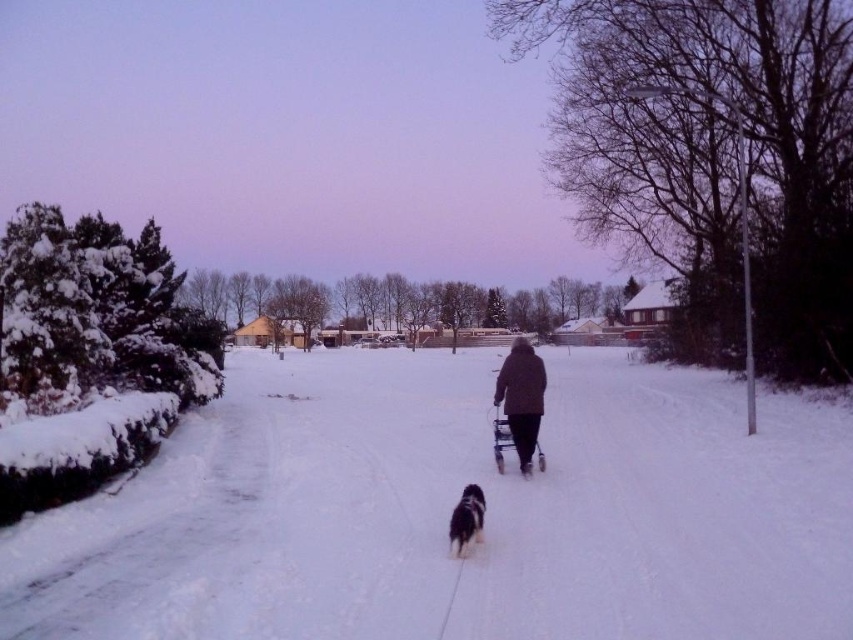
Between fluffy black dog at center and black plastic walker at center, which one is positioned lower?

fluffy black dog at center is below.

Can you confirm if fluffy black dog at center is bigger than black plastic walker at center?

Correct, fluffy black dog at center is larger in size than black plastic walker at center.

Who is more forward, (462, 502) or (537, 451)?

Point (462, 502) is more forward.

What are the coordinates of `fluffy black dog at center` in the screenshot? It's located at (466, 518).

Which is in front, point (357, 614) or point (538, 444)?

Positioned in front is point (357, 614).

Locate an element on the screen. This screenshot has width=853, height=640. white fluffy snow at center is located at coordinates (450, 512).

In the scene shown: Does brown woolen coat at center have a lesser height compared to black plastic walker at center?

No, brown woolen coat at center is not shorter than black plastic walker at center.

Which of these two, brown woolen coat at center or black plastic walker at center, stands shorter?

Standing shorter between the two is black plastic walker at center.

Is point (543, 376) closer to camera compared to point (498, 464)?

Yes, it is in front of point (498, 464).

Image resolution: width=853 pixels, height=640 pixels. I want to click on brown woolen coat at center, so click(x=521, y=397).